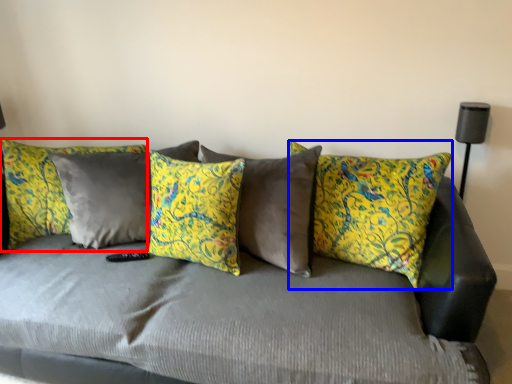
Question: Which of the following is the closest to the observer, pillow (highlighted by a red box) or pillow (highlighted by a blue box)?

Choices:
 (A) pillow
 (B) pillow

Answer: (B)